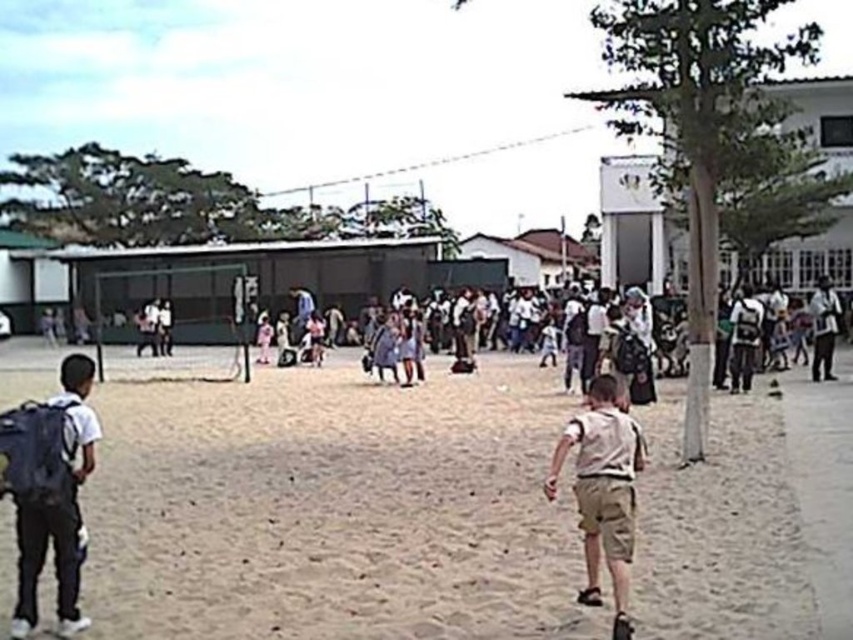
Can you confirm if brown sandy dirt field at center is positioned below black fabric backpack at left?

Correct, brown sandy dirt field at center is located below black fabric backpack at left.

Who is positioned more to the right, brown sandy dirt field at center or black fabric backpack at left?

brown sandy dirt field at center

Who is more distant from viewer, (126,522) or (61,541)?

The point (126,522) is behind.

I want to click on brown sandy dirt field at center, so click(335, 508).

Can you confirm if brown sandy dirt field at center is smaller than khaki shorts at center?

No, brown sandy dirt field at center is not smaller than khaki shorts at center.

Does brown sandy dirt field at center have a larger size compared to khaki shorts at center?

Correct, brown sandy dirt field at center is larger in size than khaki shorts at center.

This screenshot has height=640, width=853. In order to click on brown sandy dirt field at center in this screenshot , I will do tap(335, 508).

Identify the location of brown sandy dirt field at center. (335, 508).

Which of these two, black fabric backpack at left or khaki shorts at center, stands taller?

With more height is khaki shorts at center.

In order to click on black fabric backpack at left in this screenshot , I will do `click(53, 497)`.

Between point (54, 502) and point (583, 506), which one is positioned behind?

Point (54, 502)

Where is `black fabric backpack at left`? This screenshot has width=853, height=640. black fabric backpack at left is located at coordinates (53, 497).